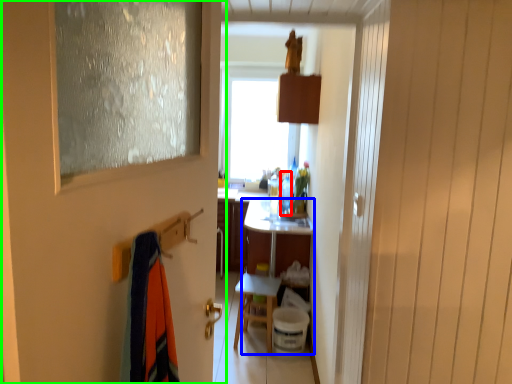
Question: Estimate the real-world distances between objects in this image. Which object is farther from bottle (highlighted by a red box), vanity (highlighted by a blue box) or door (highlighted by a green box)?

Choices:
 (A) vanity
 (B) door

Answer: (B)